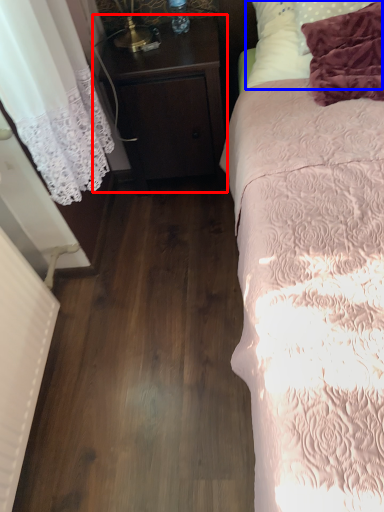
Question: Which point is further to the camera, nightstand (highlighted by a red box) or pillow (highlighted by a blue box)?

Choices:
 (A) nightstand
 (B) pillow

Answer: (A)